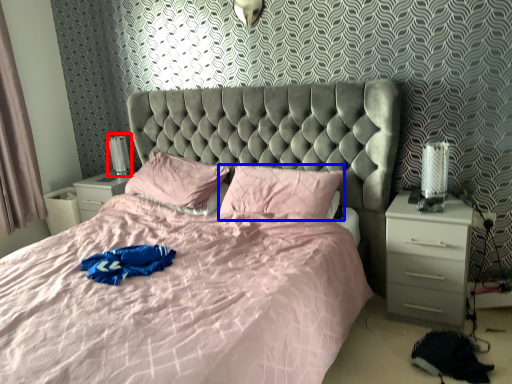
Question: Which object is closer to the camera taking this photo, table lamp (highlighted by a red box) or pillow (highlighted by a blue box)?

Choices:
 (A) table lamp
 (B) pillow

Answer: (B)